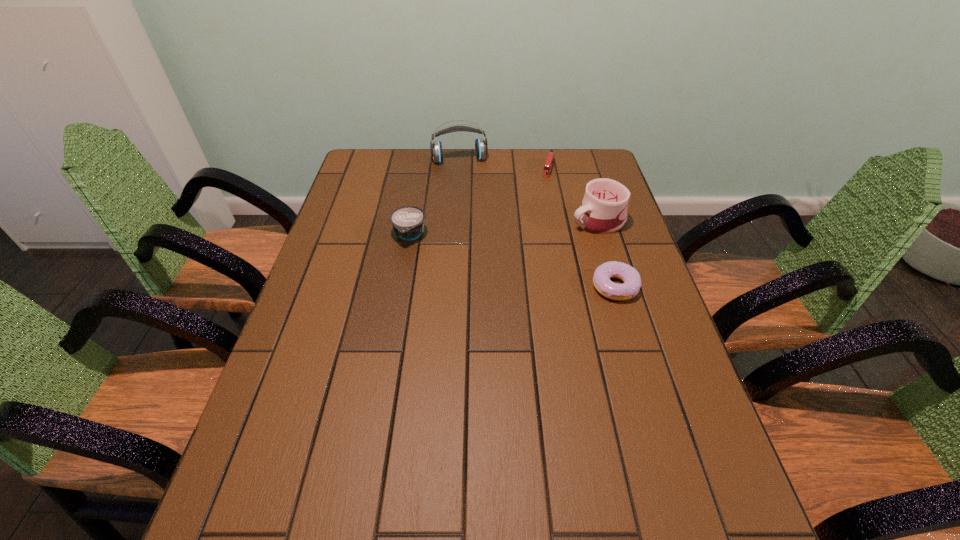
I want to click on free space on the desktop that is between the yogurt and the nearest object and is positioned on the ear cups of the headset, so click(478, 252).

Image resolution: width=960 pixels, height=540 pixels. I want to click on free space on the desktop that is between the third shortest object and the nearest object and is positioned on the side with the handle of the mug, so click(484, 254).

Identify the location of free space on the desktop that is between the yogurt and the nearest object and is positioned on the front-facing side of the stapler. The height and width of the screenshot is (540, 960). tap(518, 262).